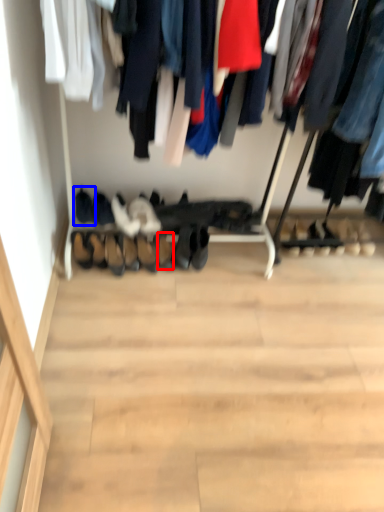
Question: Which object is closer to the camera taking this photo, shoe (highlighted by a red box) or footwear (highlighted by a blue box)?

Choices:
 (A) shoe
 (B) footwear

Answer: (A)